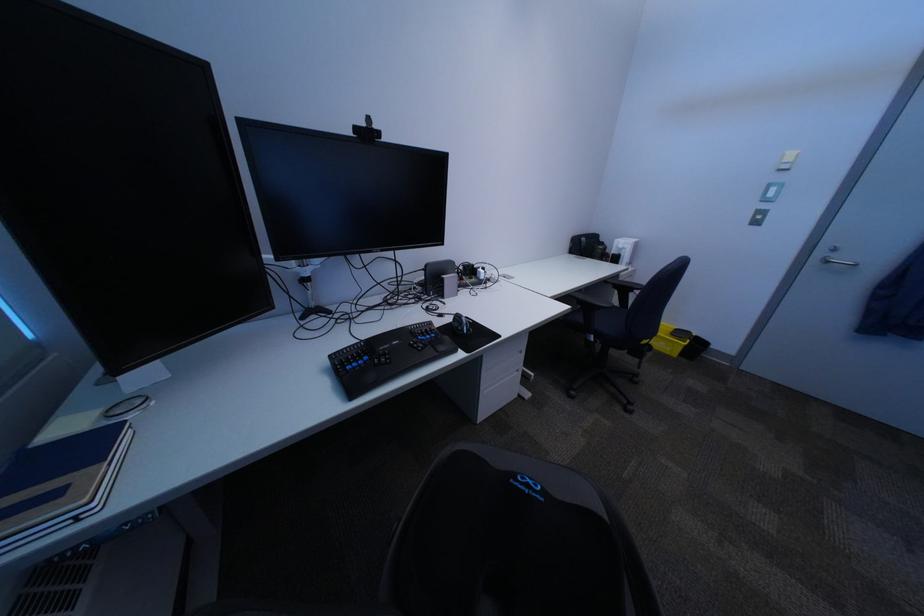
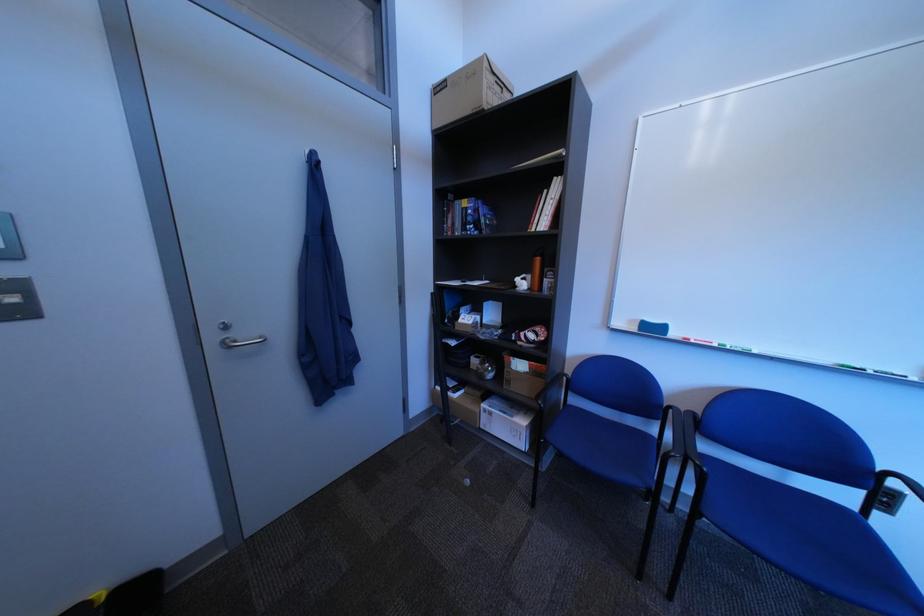
Find the pixel in the second image that matches the point at 834,254 in the first image.

(226, 339)